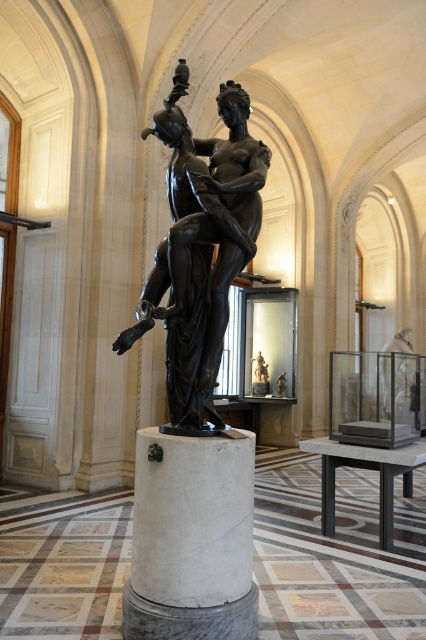
Question: Which point is farther from the camera taking this photo?

Choices:
 (A) (221, 202)
 (B) (198, 460)

Answer: (A)

Question: Among these points, which one is nearest to the camera?

Choices:
 (A) (x=181, y=243)
 (B) (x=245, y=586)

Answer: (B)

Question: Among these objects, which one is farthest from the camera?

Choices:
 (A) bronze statue at center
 (B) white marble pillar at center

Answer: (A)

Question: Does bronze statue at center lie in front of white marble pillar at center?

Choices:
 (A) no
 (B) yes

Answer: (A)

Question: Can you confirm if bronze statue at center is positioned to the left of white marble pillar at center?

Choices:
 (A) no
 (B) yes

Answer: (A)

Question: Where is bronze statue at center located in relation to white marble pillar at center in the image?

Choices:
 (A) left
 (B) right

Answer: (B)